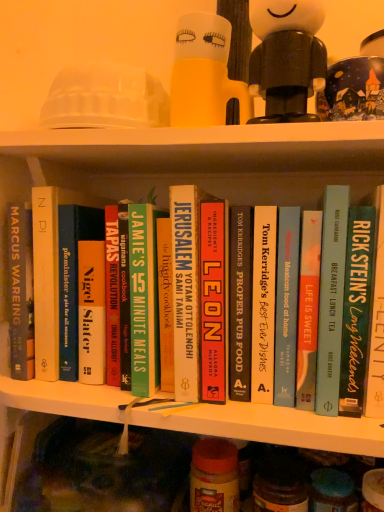
The image size is (384, 512). What are the coordinates of `free space in front of hardcover book at center, the 4th book positioned from the left` in the screenshot? It's located at (249, 410).